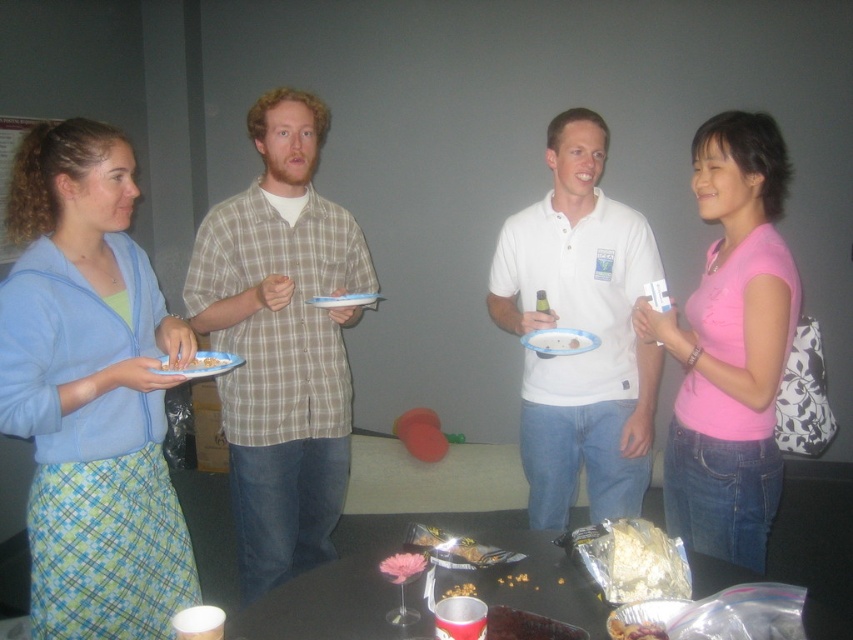
You are trying to decide which item to grab first from the table. Since the light blue fabric sweater at left is smaller than the plaid shirt at center, which one would you choose to pick up first?

The light blue fabric sweater at left is smaller than the plaid shirt at center, so it might be easier to pick up first.